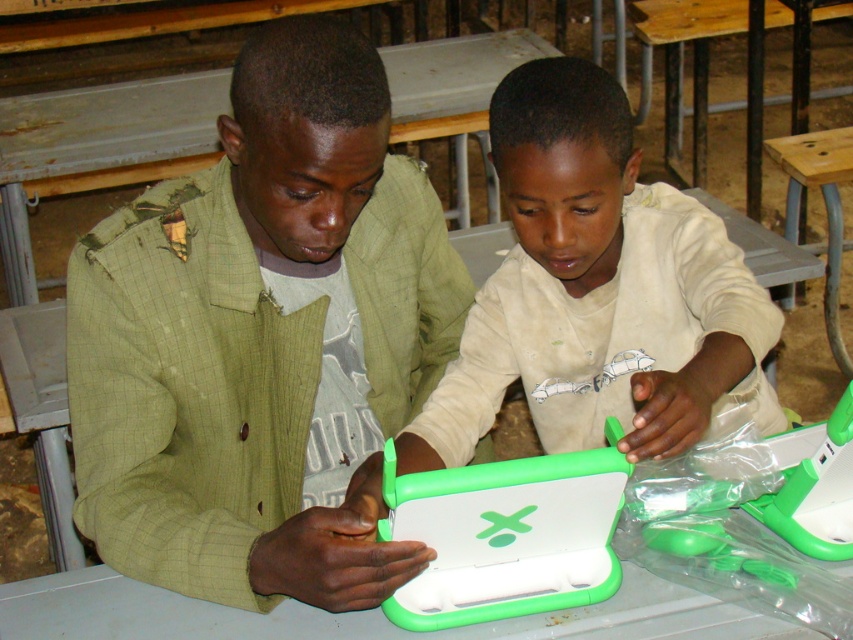
You are a student trying to locate the green matte laptop at center in the classroom. The teacher mentioned that it is positioned at coordinates point (262,339). Can you confirm if this point is within the classroom area?

The point (262,339) corresponds to the green matte laptop at center, which is indeed located within the classroom area as described in the scene.

You are a student who needs to choose between the green matte laptop at center and the matte green tablet at center for a presentation. Which device is taller?

The green matte laptop at center is taller than the matte green tablet at center.